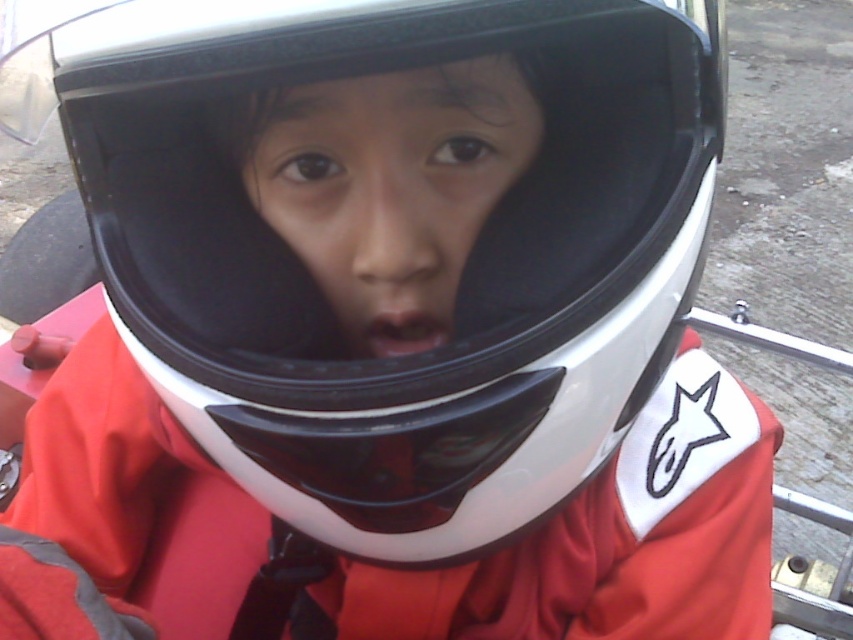
You are a drone operator trying to navigate between two points in the image. The first point is point (549, 360) and the second point is point (439, 307). According to the image, which point is closer to the front?

Point (549, 360) is in front of point (439, 307), so it is closer to the front.

From the picture: You are a photographer trying to capture the reflection of the matte black helmet at center in the matte black mouth at center. Based on their positions, can you tell which object is closer to the left side of the image?

The matte black helmet at center is positioned on the left side of matte black mouth at center, so the matte black helmet at center is closer to the left side of the image.